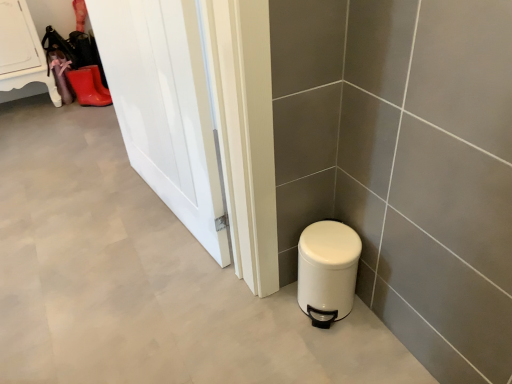
Question: Is rubber matte boot at upper left directly adjacent to white matte trash can at lower right?

Choices:
 (A) yes
 (B) no

Answer: (B)

Question: From the image's perspective, is rubber matte boot at upper left over white matte trash can at lower right?

Choices:
 (A) yes
 (B) no

Answer: (A)

Question: Does rubber matte boot at upper left have a lesser width compared to white matte trash can at lower right?

Choices:
 (A) yes
 (B) no

Answer: (B)

Question: Considering the relative positions of rubber matte boot at upper left and white matte trash can at lower right in the image provided, is rubber matte boot at upper left to the left of white matte trash can at lower right from the viewer's perspective?

Choices:
 (A) no
 (B) yes

Answer: (B)

Question: Is rubber matte boot at upper left shorter than white matte trash can at lower right?

Choices:
 (A) yes
 (B) no

Answer: (A)

Question: Considering the positions of white matte trash can at lower right and white glossy door at left in the image, is white matte trash can at lower right taller or shorter than white glossy door at left?

Choices:
 (A) tall
 (B) short

Answer: (B)

Question: Considering the positions of white matte trash can at lower right and white glossy door at left in the image, is white matte trash can at lower right wider or thinner than white glossy door at left?

Choices:
 (A) wide
 (B) thin

Answer: (A)

Question: Relative to white glossy door at left, is white matte trash can at lower right in front or behind?

Choices:
 (A) behind
 (B) front

Answer: (A)

Question: Is white matte trash can at lower right situated inside white glossy door at left or outside?

Choices:
 (A) inside
 (B) outside

Answer: (B)

Question: Is white glossy door at left spatially inside rubber matte boot at upper left, or outside of it?

Choices:
 (A) outside
 (B) inside

Answer: (A)

Question: From their relative heights in the image, would you say white glossy door at left is taller or shorter than rubber matte boot at upper left?

Choices:
 (A) tall
 (B) short

Answer: (A)

Question: Considering the relative positions of white glossy door at left and rubber matte boot at upper left in the image provided, is white glossy door at left to the left or to the right of rubber matte boot at upper left?

Choices:
 (A) right
 (B) left

Answer: (A)

Question: Relative to rubber matte boot at upper left, is white glossy door at left in front or behind?

Choices:
 (A) front
 (B) behind

Answer: (A)

Question: In terms of size, does white glossy door at left appear bigger or smaller than white matte trash can at lower right?

Choices:
 (A) big
 (B) small

Answer: (A)

Question: Considering their positions, is white glossy door at left located in front of or behind white matte trash can at lower right?

Choices:
 (A) behind
 (B) front

Answer: (B)